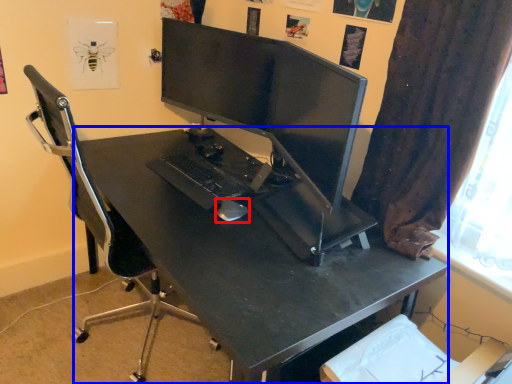
Question: Which of the following is the farthest to the observer, mouse (highlighted by a red box) or desk (highlighted by a blue box)?

Choices:
 (A) mouse
 (B) desk

Answer: (A)